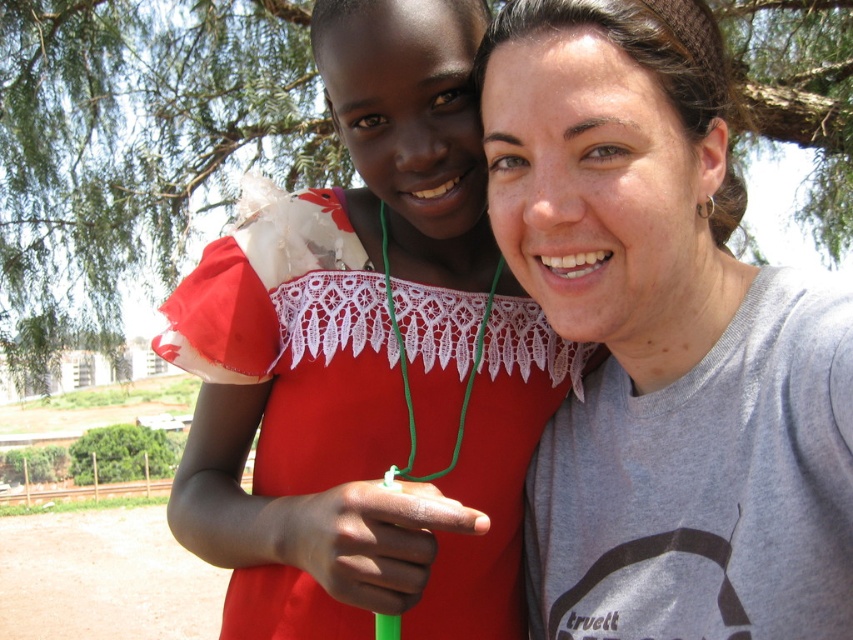
What do you see at coordinates (663, 340) in the screenshot?
I see `gray cotton t-shirt at center` at bounding box center [663, 340].

Is gray cotton t-shirt at center to the right of matte red dress at center from the viewer's perspective?

Indeed, gray cotton t-shirt at center is positioned on the right side of matte red dress at center.

What do you see at coordinates (663, 340) in the screenshot? This screenshot has height=640, width=853. I see `gray cotton t-shirt at center` at bounding box center [663, 340].

The width and height of the screenshot is (853, 640). Identify the location of gray cotton t-shirt at center. (663, 340).

Which of these two, matte red dress at center or green leafy tree at upper center, stands shorter?

With less height is matte red dress at center.

Is point (448, 134) positioned before point (67, 198)?

That is True.

Is point (444, 618) in front of point (44, 268)?

Yes.

Where is `matte red dress at center`? matte red dress at center is located at coordinates (367, 362).

Can you confirm if gray cotton t-shirt at center is smaller than green leafy tree at upper center?

Correct, gray cotton t-shirt at center occupies less space than green leafy tree at upper center.

Is gray cotton t-shirt at center taller than green leafy tree at upper center?

In fact, gray cotton t-shirt at center may be shorter than green leafy tree at upper center.

Where is `gray cotton t-shirt at center`? The width and height of the screenshot is (853, 640). gray cotton t-shirt at center is located at coordinates (663, 340).

The height and width of the screenshot is (640, 853). Find the location of `gray cotton t-shirt at center`. gray cotton t-shirt at center is located at coordinates (663, 340).